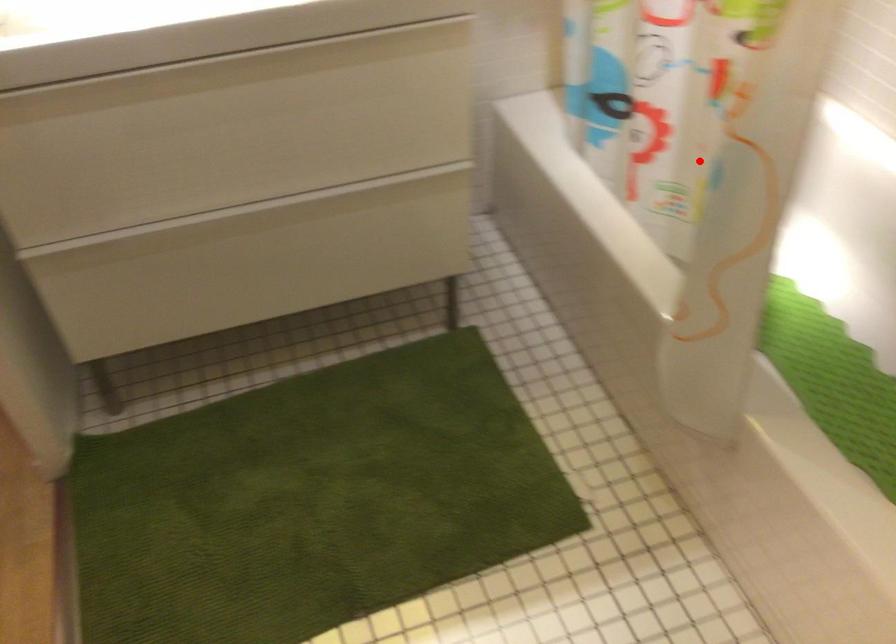
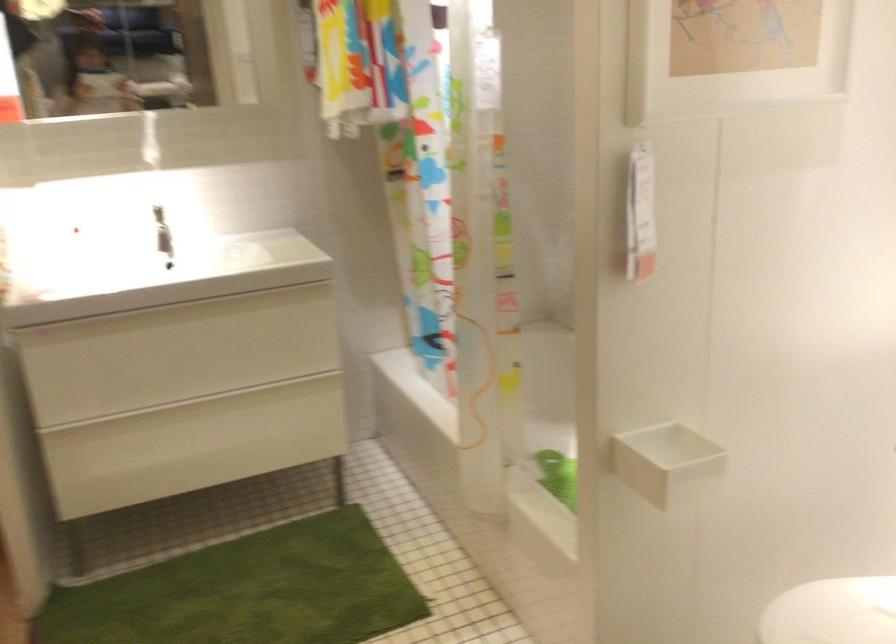
The point at the highlighted location is marked in the first image. Where is the corresponding point in the second image?

(492, 366)